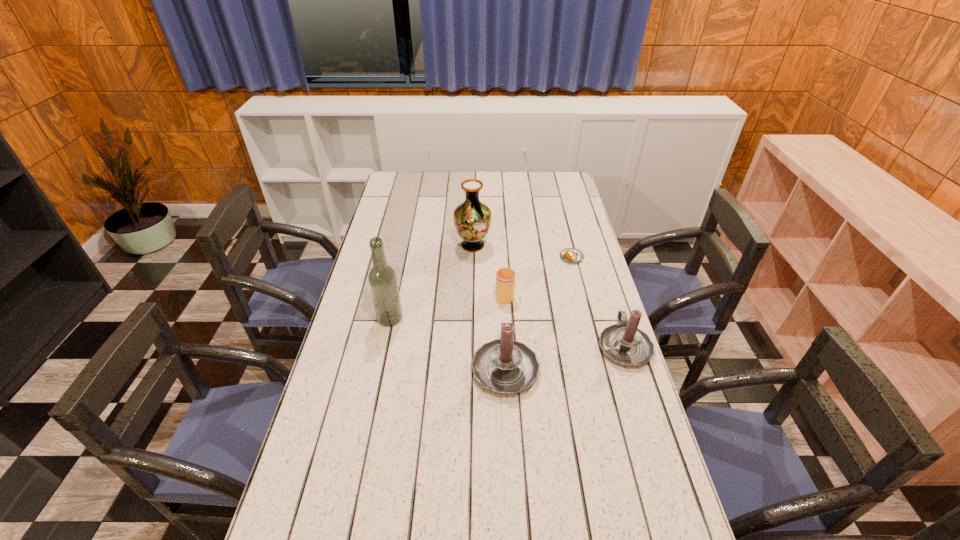
Where is `the fourth shortest object`? This screenshot has width=960, height=540. the fourth shortest object is located at coordinates (504, 366).

What are the coordinates of `the taller candle` in the screenshot? It's located at (504, 366).

You are a GUI agent. You are given a task and a screenshot of the screen. Output one action in this format:
    pyautogui.click(x=<x>, y=<y>)
    Task: Click on the third shortest object
    This screenshot has height=540, width=960.
    Given the screenshot: What is the action you would take?
    pyautogui.click(x=624, y=343)

This screenshot has width=960, height=540. I want to click on the right candle, so click(624, 343).

Locate an element on the screen. The image size is (960, 540). vase is located at coordinates (472, 219).

At what (x,y) coordinates should I click in order to perform the action: click on the shortest object. Please return your answer as a coordinate pair (x, y). The height and width of the screenshot is (540, 960). Looking at the image, I should click on coord(571,255).

Find the location of `the third farthest object`. the third farthest object is located at coordinates (505, 277).

I want to click on cup, so click(x=505, y=277).

Where is `liquor`? The height and width of the screenshot is (540, 960). liquor is located at coordinates (382, 278).

The image size is (960, 540). I want to click on free point located on the side of the left candle with the handle loop, so click(501, 298).